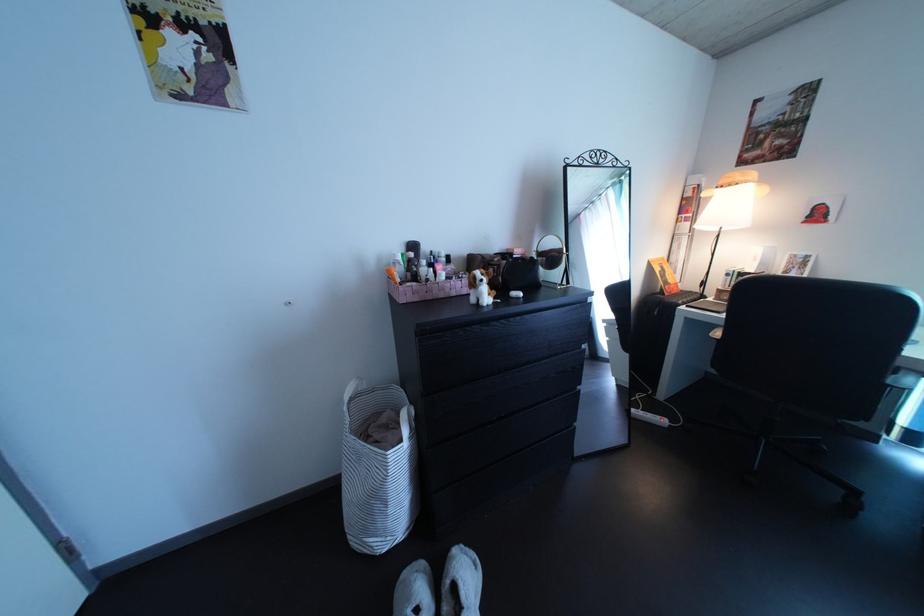
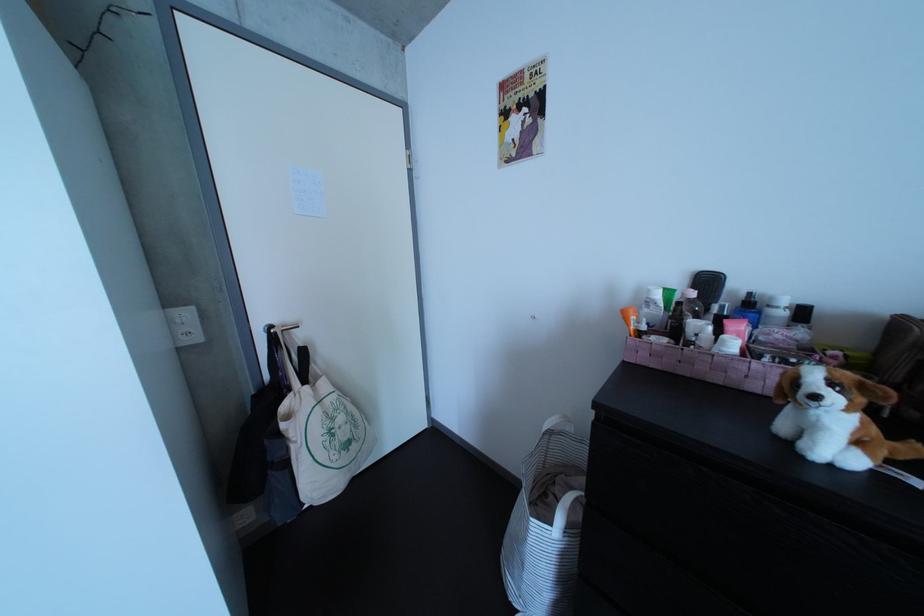
In the second image, find the point that corresponds to pixel 403 461 in the first image.

(545, 527)